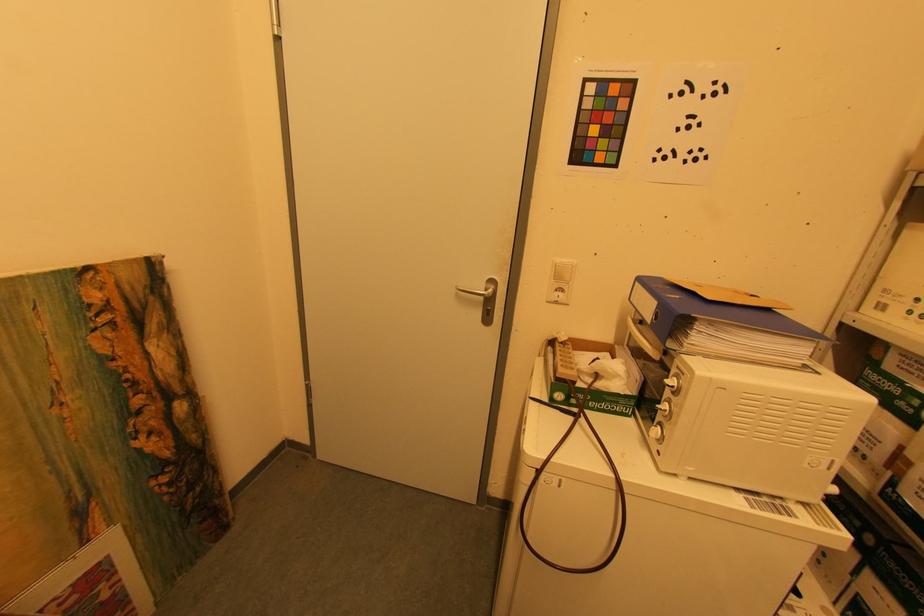
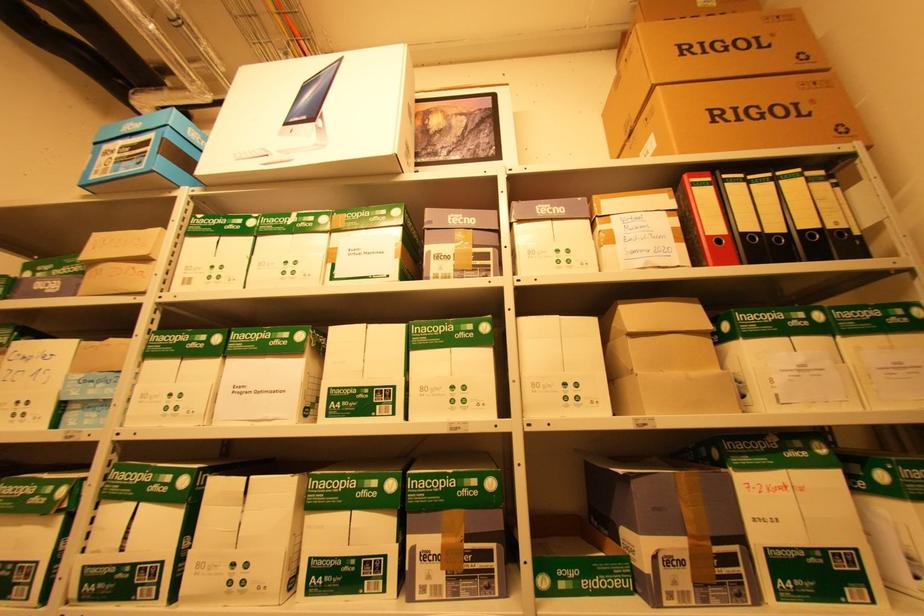
Question: How did the camera likely rotate?

Choices:
 (A) Left
 (B) Right
 (C) Up
 (D) Down

Answer: (B)